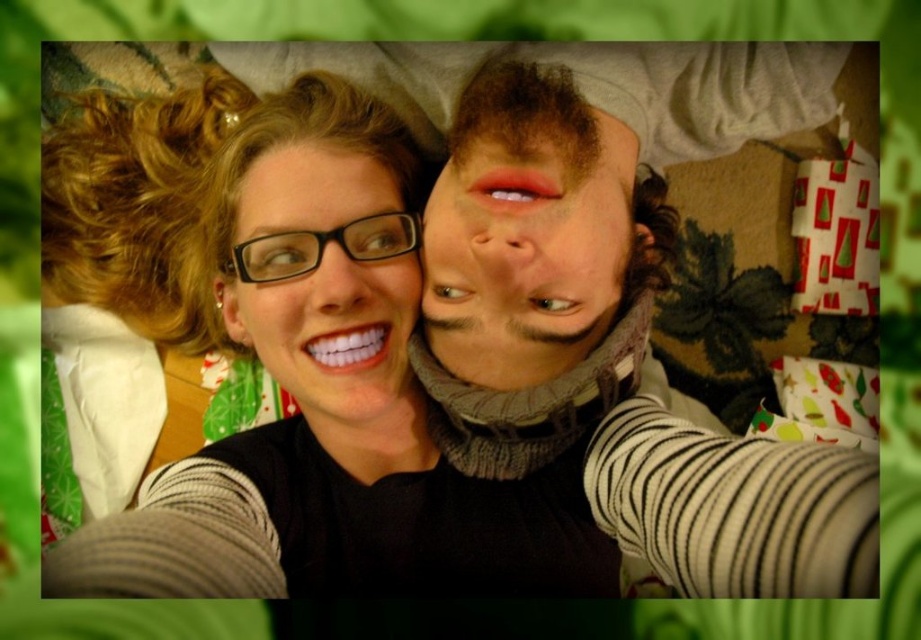
Question: Which object is the farthest from the matte black glasses at upper left?

Choices:
 (A) matte black glasses at center
 (B) matte gray sweater at center

Answer: (B)

Question: Is matte black glasses at upper left to the right of matte gray sweater at center from the viewer's perspective?

Choices:
 (A) no
 (B) yes

Answer: (A)

Question: Does matte black glasses at upper left have a lesser width compared to matte black glasses at center?

Choices:
 (A) yes
 (B) no

Answer: (B)

Question: Which of the following is the closest to the observer?

Choices:
 (A) matte black glasses at center
 (B) matte black glasses at upper left

Answer: (B)

Question: Can you confirm if matte gray sweater at center is bigger than matte black glasses at center?

Choices:
 (A) yes
 (B) no

Answer: (A)

Question: Estimate the real-world distances between objects in this image. Which object is farther from the matte black glasses at upper left?

Choices:
 (A) matte gray sweater at center
 (B) matte black glasses at center

Answer: (A)